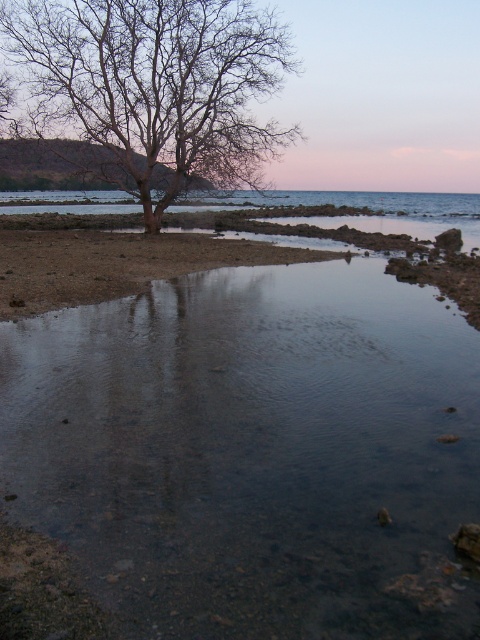
Which of these two, clear water at center or bare wood tree at upper left, stands shorter?

clear water at center is shorter.

Does clear water at center come behind bare wood tree at upper left?

No, clear water at center is in front of bare wood tree at upper left.

What do you see at coordinates (253, 452) in the screenshot?
I see `clear water at center` at bounding box center [253, 452].

Identify the location of clear water at center. pyautogui.click(x=253, y=452).